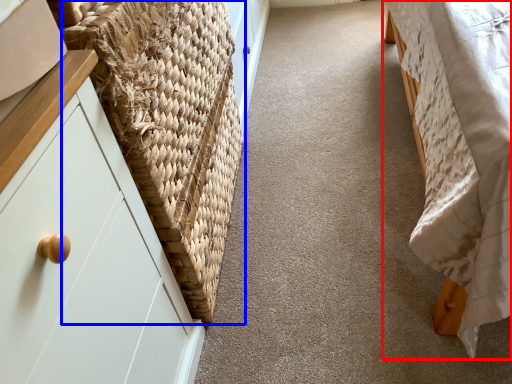
Question: Which point is closer to the camera, furniture (highlighted by a red box) or basket (highlighted by a blue box)?

Choices:
 (A) furniture
 (B) basket

Answer: (A)